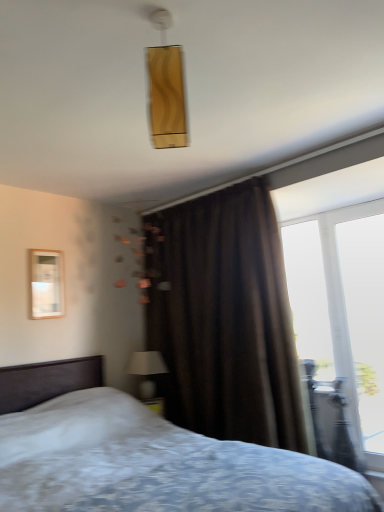
Question: From the image's perspective, is white textured bed at center below brown velvet curtain at center?

Choices:
 (A) no
 (B) yes

Answer: (B)

Question: Does white textured bed at center have a larger size compared to brown velvet curtain at center?

Choices:
 (A) yes
 (B) no

Answer: (A)

Question: Is white textured bed at center directly adjacent to brown velvet curtain at center?

Choices:
 (A) no
 (B) yes

Answer: (A)

Question: Is white textured bed at center closer to camera compared to brown velvet curtain at center?

Choices:
 (A) no
 (B) yes

Answer: (B)

Question: Can you confirm if white textured bed at center is wider than brown velvet curtain at center?

Choices:
 (A) no
 (B) yes

Answer: (B)

Question: From a real-world perspective, relative to matte white lampshade at lower center, is gold textured rectangular light fixture at upper center vertically above or below?

Choices:
 (A) below
 (B) above

Answer: (B)

Question: Choose the correct answer: Is gold textured rectangular light fixture at upper center inside matte white lampshade at lower center or outside it?

Choices:
 (A) inside
 (B) outside

Answer: (B)

Question: Looking at their shapes, would you say gold textured rectangular light fixture at upper center is wider or thinner than matte white lampshade at lower center?

Choices:
 (A) wide
 (B) thin

Answer: (B)

Question: Is point (162, 17) positioned closer to the camera than point (132, 370)?

Choices:
 (A) farther
 (B) closer

Answer: (B)

Question: Is brown velvet curtain at center wider or thinner than metallic silver armchair at right?

Choices:
 (A) thin
 (B) wide

Answer: (B)

Question: Considering the positions of point (276, 317) and point (327, 442), is point (276, 317) closer or farther from the camera than point (327, 442)?

Choices:
 (A) closer
 (B) farther

Answer: (A)

Question: From a real-world perspective, is brown velvet curtain at center above or below metallic silver armchair at right?

Choices:
 (A) below
 (B) above

Answer: (B)

Question: In the image, is brown velvet curtain at center on the left side or the right side of metallic silver armchair at right?

Choices:
 (A) left
 (B) right

Answer: (A)

Question: In terms of size, does matte white lampshade at lower center appear bigger or smaller than transparent glass window at right?

Choices:
 (A) big
 (B) small

Answer: (B)

Question: From their relative heights in the image, would you say matte white lampshade at lower center is taller or shorter than transparent glass window at right?

Choices:
 (A) short
 (B) tall

Answer: (A)